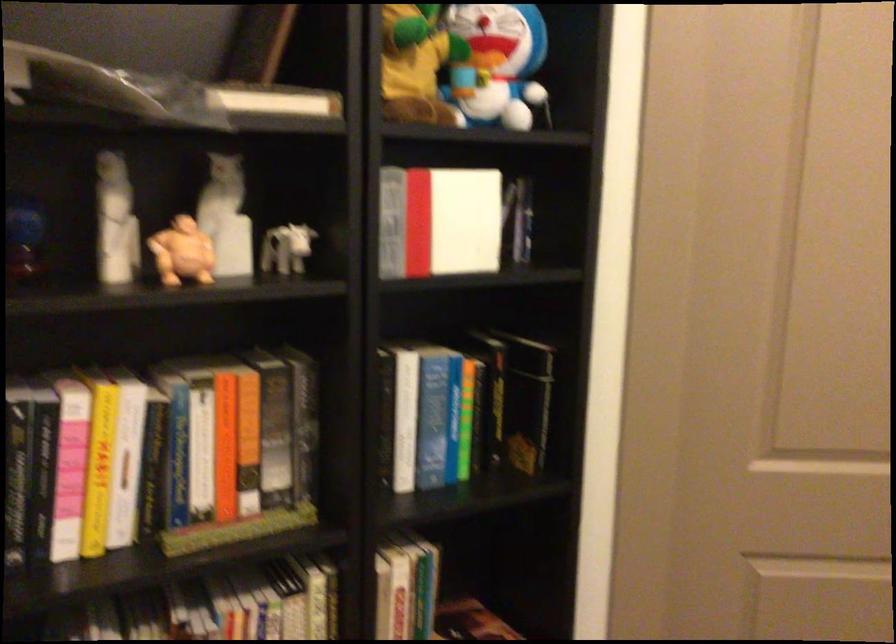
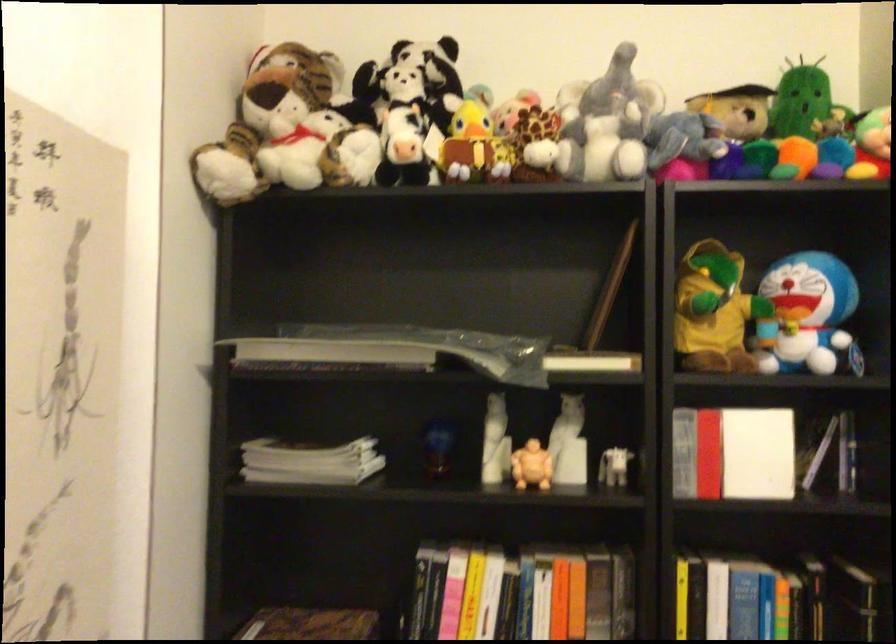
Locate, in the second image, the point that corresponds to (288,251) in the first image.

(615, 468)